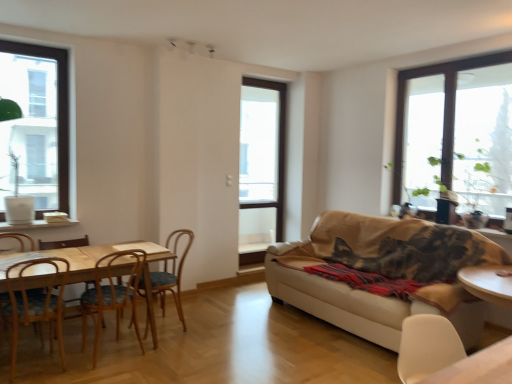
Identify the location of free location to the right of wooden chair at center, which is counted as the fifth chair, starting from the front. (212, 331).